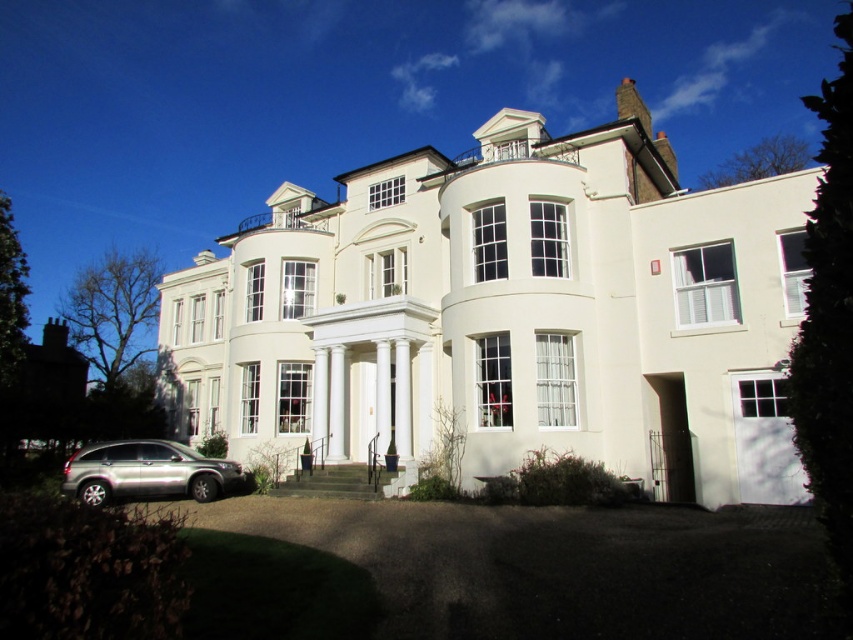
Is white glossy mansion at center smaller than dark asphalt driveway at lower center?

No.

Does white glossy mansion at center appear over dark asphalt driveway at lower center?

Yes.

This screenshot has height=640, width=853. What do you see at coordinates (508, 314) in the screenshot?
I see `white glossy mansion at center` at bounding box center [508, 314].

Identify the location of white glossy mansion at center. Image resolution: width=853 pixels, height=640 pixels. (508, 314).

Can you confirm if dark asphalt driveway at lower center is bigger than silver metallic suv at lower left?

Yes, dark asphalt driveway at lower center is bigger than silver metallic suv at lower left.

Is point (306, 564) positioned in front of point (99, 502)?

Yes, it is in front of point (99, 502).

Where is `dark asphalt driveway at lower center`? The height and width of the screenshot is (640, 853). dark asphalt driveway at lower center is located at coordinates (502, 572).

Between white glossy mansion at center and silver metallic suv at lower left, which one appears on the left side from the viewer's perspective?

From the viewer's perspective, silver metallic suv at lower left appears more on the left side.

Is point (399, 396) farther from viewer compared to point (207, 461)?

Yes, it is.

Where is `white glossy mansion at center`? white glossy mansion at center is located at coordinates (508, 314).